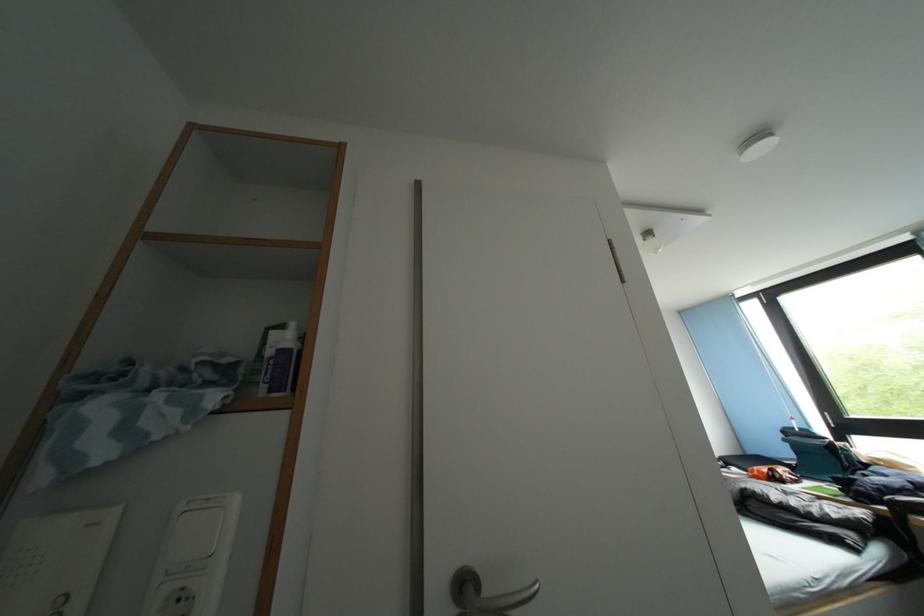
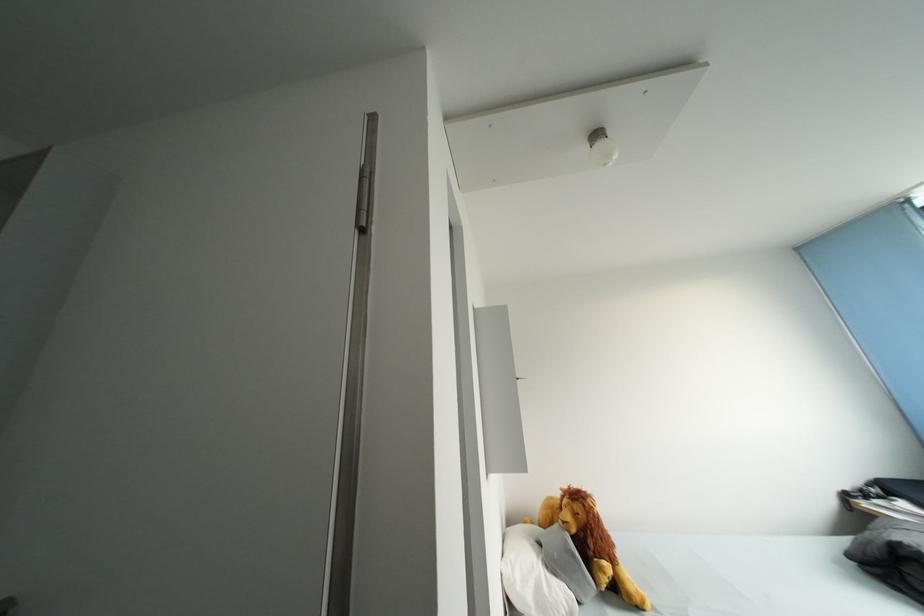
Which direction would the cameraman need to move to produce the second image?

The cameraman walked toward right, forward.